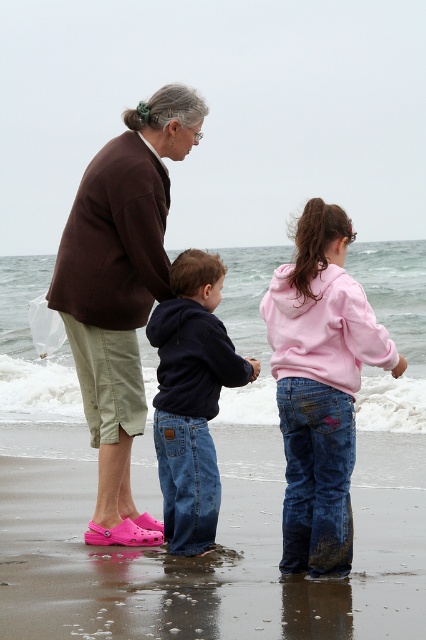
You are a photographer trying to capture a group photo of the pink rubber shoes at lower left and the dark blue hoodie at center. To ensure both are in frame, should you adjust your camera to the left or right? Explain your reasoning based on their positions.

The pink rubber shoes at lower left are to the left of the dark blue hoodie at center. To include both in the frame, you should adjust your camera to the left to capture the pink rubber shoes at lower left and to the right to include the dark blue hoodie at center. However, since the pink rubber shoes are already positioned to the left of the dark blue hoodie, centering the camera between them would ensure both are in frame without needing significant adjustment.

You are a photographer trying to capture a group photo of the brown fabric jacket at upper left and the pink fleece sweatshirt at center. Since you want both subjects to be visible clearly in the photo, which subject should you focus on first to ensure proper focus?

The brown fabric jacket at upper left should be focused on first because it has a greater height compared to the pink fleece sweatshirt at center, so it will appear larger in the photo and require more precise focusing to ensure clarity.

You are a photographer trying to capture a group photo of the pink rubber shoes at lower left and the dark blue hoodie at center. Which object should you focus on first if you want to ensure both are in the frame?

The pink rubber shoes at lower left is smaller than the dark blue hoodie at center, so you should focus on the dark blue hoodie at center first to ensure it fits within the frame.